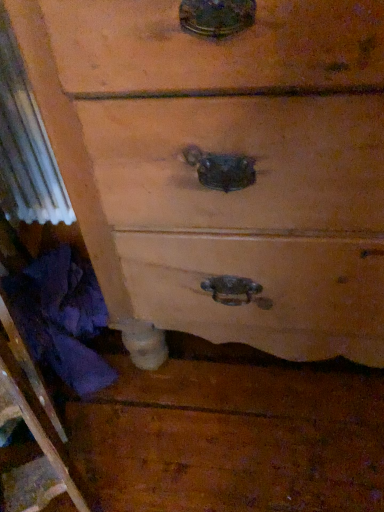
What do you see at coordinates (251, 218) in the screenshot?
I see `wooden drawer at center` at bounding box center [251, 218].

Find the location of a particular element. wooden drawer at center is located at coordinates (251, 218).

Find the location of a particular element. wooden drawer at center is located at coordinates (251, 218).